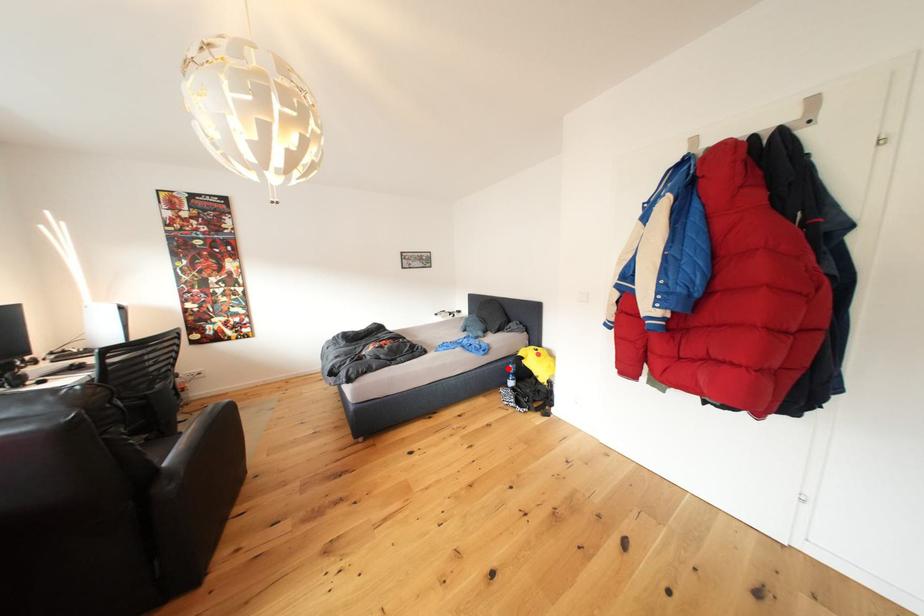
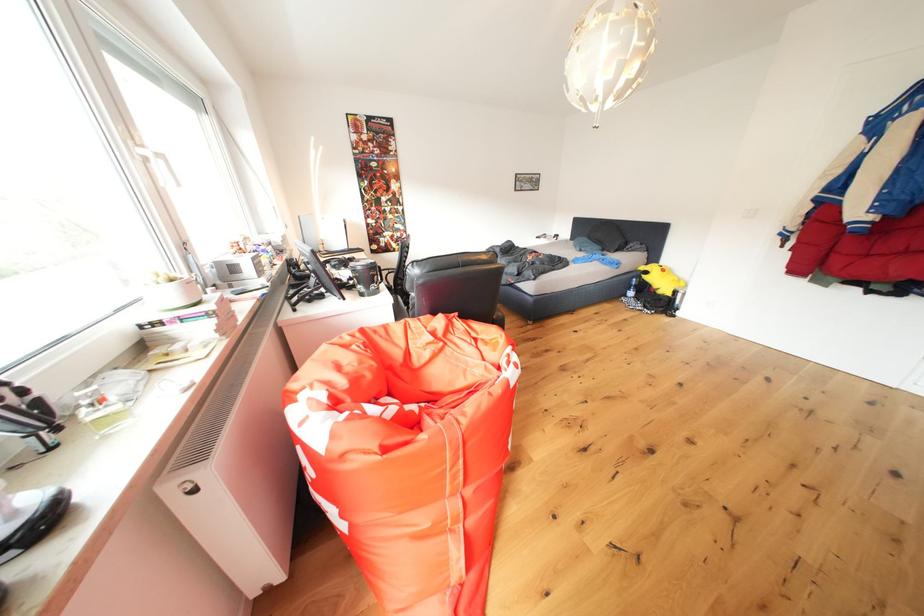
Where in the second image is the point corresponding to the highlighted location from the first image?

(634, 282)